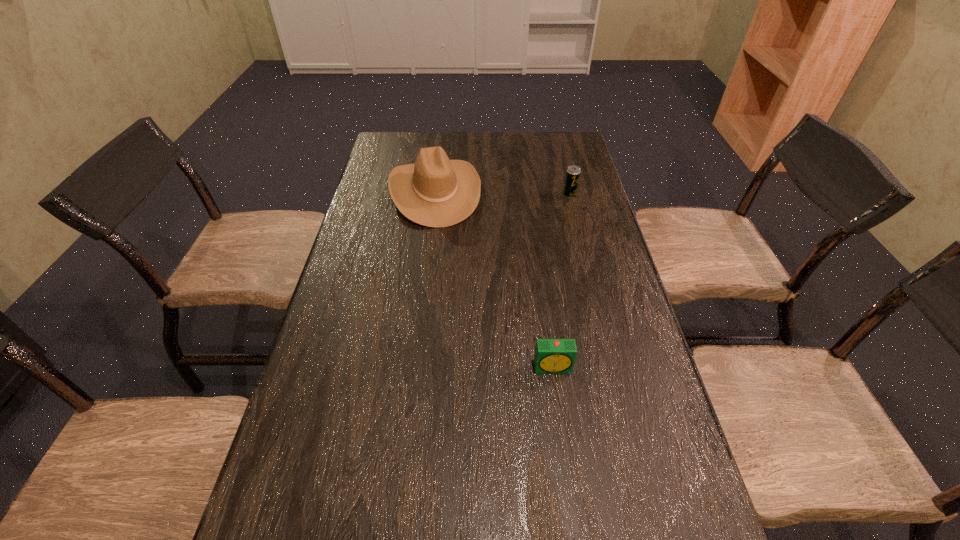
Find the location of a particular element. Image resolution: width=960 pixels, height=540 pixels. the tallest object is located at coordinates [x=434, y=191].

Identify the location of the leftmost object. (434, 191).

This screenshot has width=960, height=540. In order to click on beer can in this screenshot , I will do `click(573, 172)`.

The image size is (960, 540). Find the location of `the shortest object`. the shortest object is located at coordinates (552, 356).

This screenshot has height=540, width=960. Identify the location of alarm clock. (552, 356).

This screenshot has width=960, height=540. What are the coordinates of `vacant space situated on the back of the tallest object` in the screenshot? It's located at (441, 147).

Locate an element on the screen. free space located on the back of the beer can is located at coordinates (564, 173).

At what (x,y) coordinates should I click in order to perform the action: click on vacant point located 0.070m on the front-facing side of the nearest object. Please return your answer as a coordinate pair (x, y). Image resolution: width=960 pixels, height=540 pixels. Looking at the image, I should click on (559, 403).

This screenshot has height=540, width=960. I want to click on object at the far edge, so click(434, 191).

Find the location of a particular element. The width and height of the screenshot is (960, 540). object positioned at the left edge is located at coordinates pyautogui.click(x=434, y=191).